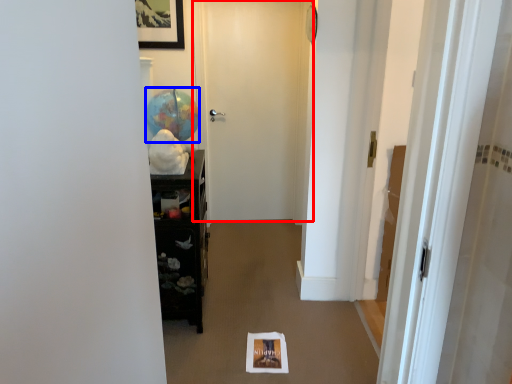
Question: Which point is further to the camera, door (highlighted by a red box) or balloon (highlighted by a blue box)?

Choices:
 (A) door
 (B) balloon

Answer: (A)